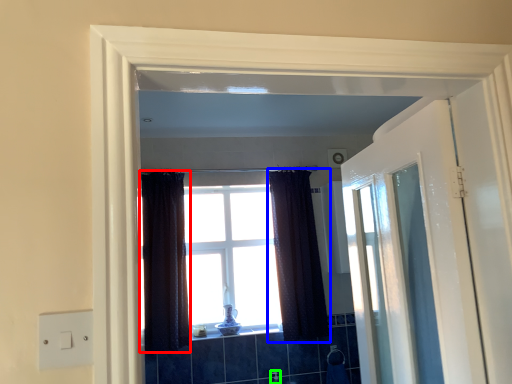
Question: Based on their relative distances, which object is farther from curtain (highlighted by a red box)? Choose from curtain (highlighted by a blue box) and faucet (highlighted by a green box).

Choices:
 (A) curtain
 (B) faucet

Answer: (B)